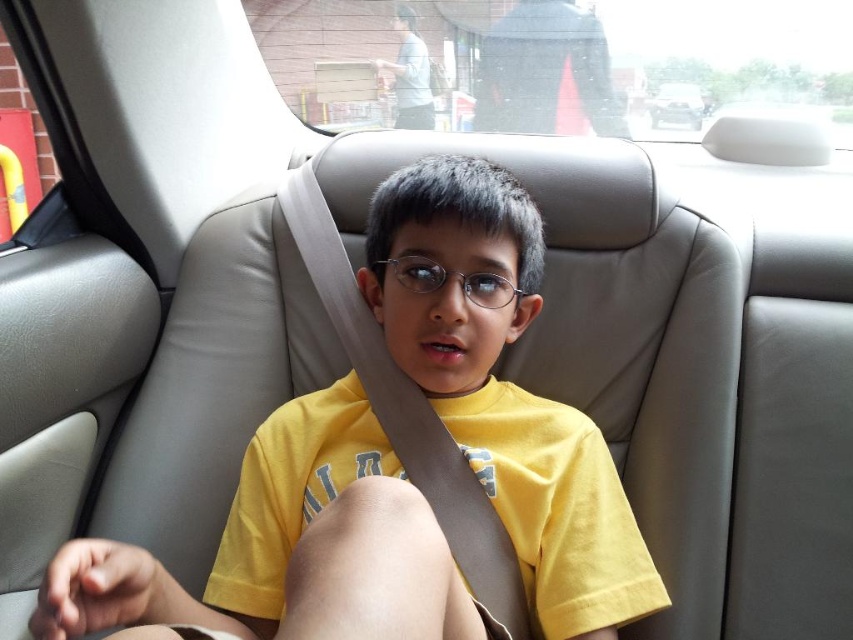
You are sitting in the driver seat of the car and want to look at two points in the back seat area. The first point is at coordinates point (329,600) and the second is at point (427,289). Which point will you see first if you look from your current position?

Point (329,600) is closer to the viewer than point (427,289), so you will see point (329,600) first when looking from the driver seat.

You are a passenger in the car and you need to reach the metallic silver glasses at center to adjust them. Is the black fabric bag at upper center blocking your access to the glasses?

The black fabric bag at upper center is positioned over the metallic silver glasses at center, so it is blocking access to the glasses.

You are a delivery robot that is 0.5 meters wide. You need to pass between two objects in the car seat. The objects are located at point (576,77). Can you fit through the space between them?

The distance between the two objects at point (576,77) is 1.73 meters. Since the robot is 0.5 meters wide, it can easily fit through the space between them as the distance is more than sufficient.